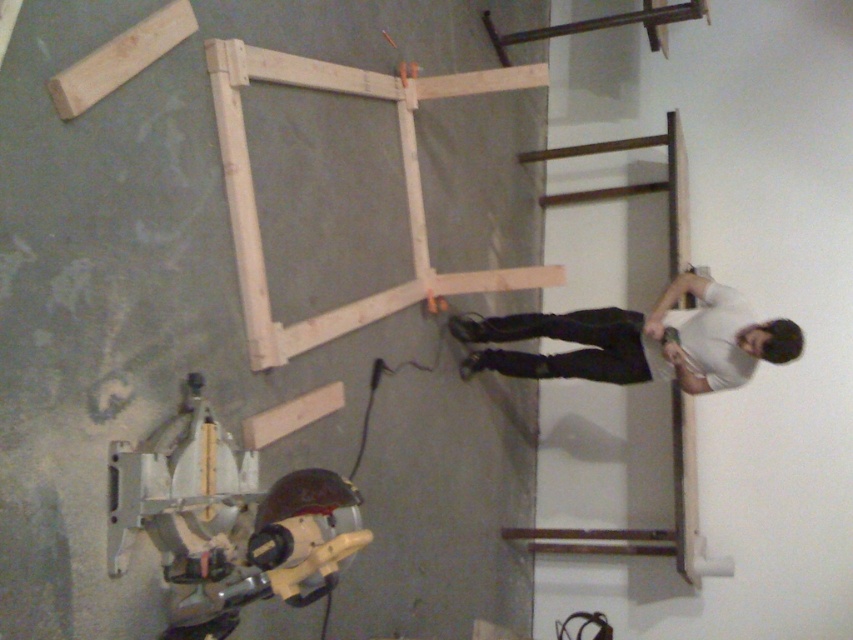
You are organizing a workshop cleanup. You need to move the metallic yellow circular saw at lower left and the brown wood window frame at right to a storage area. Which object should you move first if you want to place the larger item into storage first?

You should move the brown wood window frame at right first because the brown wood window frame at right occupies more space than the metallic yellow circular saw at lower left according to the description.